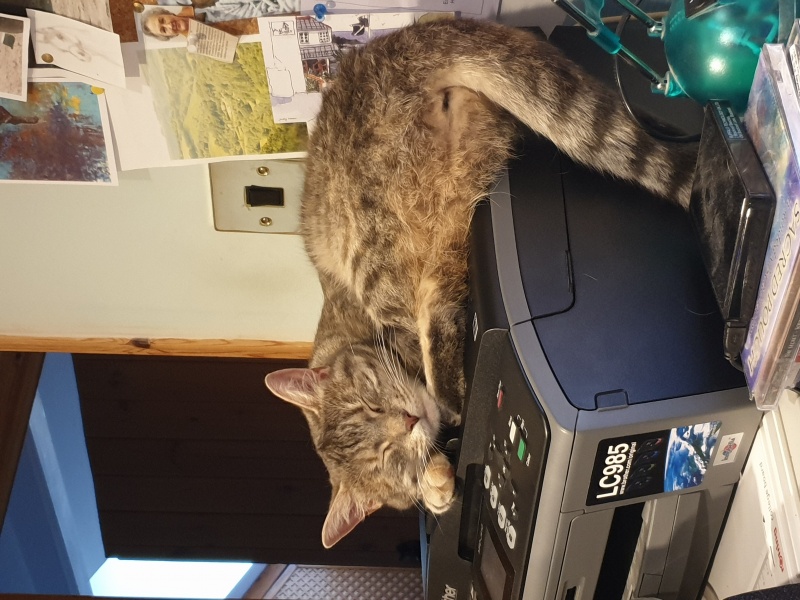
Find the location of a particular element. This screenshot has height=600, width=800. book is located at coordinates (774, 299).